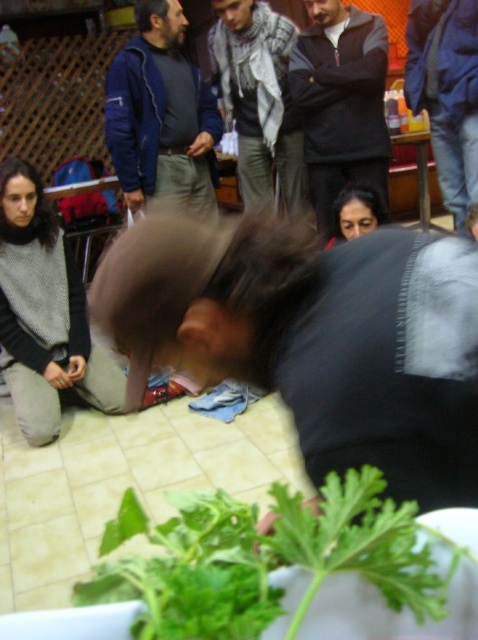
From the picture: You are a photographer trying to capture a photo of the blue denim jeans at lower right without including the blue fleece jacket at upper left in the frame. Is this possible based on their positions?

The blue fleece jacket at upper left is further to the viewer than the blue denim jeans at lower right, so it might block the view. To avoid including the blue fleece jacket at upper left, you would need to adjust your angle or position to ensure it doesn not obstruct the blue denim jeans at lower right.

You are organizing a clothing donation drive and need to determine if the dark gray sweatshirt at center can fit into a box that is 30 cm wide. Given that the matte black hair at center is 15 cm wide, can the sweatshirt fit?

The dark gray sweatshirt at center is wider than the matte black hair at center, which is 15 cm wide. Since the sweatshirt is wider than 15 cm, it might not fit into the 30 cm wide box. However, without knowing the exact width of the sweatshirt, we cannot be certain. Please measure the sweatshirt to confirm.

In the scene shown: You are a photographer trying to capture a candid shot of the scene. You want to ensure that both the knit sweater at lower left and the matte black hair at center are visible in the frame. Given their sizes, do you need to adjust your camera angle to include both?

The knit sweater at lower left is much taller than the matte black hair at center, so you should position your camera to focus on the taller knit sweater at lower left to ensure both are in view.